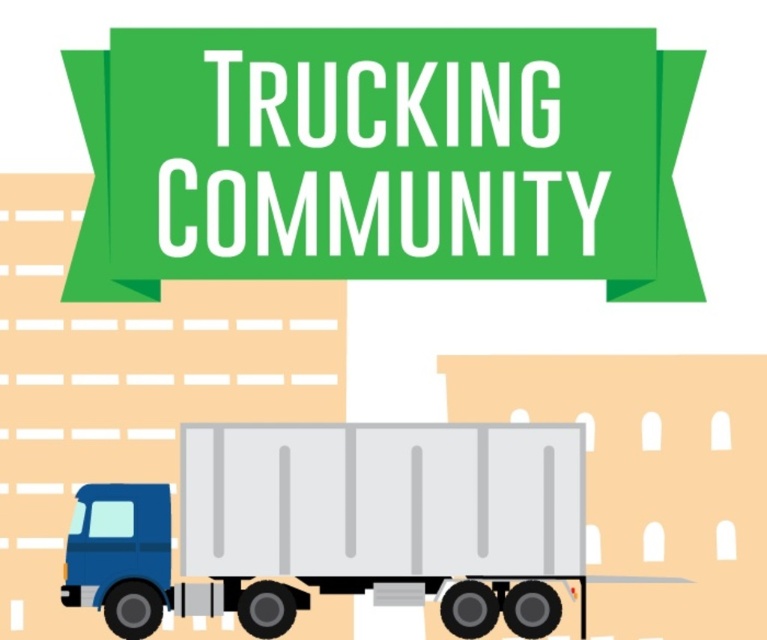
You are designing a poster and want to place a sticker on the green fabric banner at upper center. The sticker requires a space wider than the matte gray trailer truck at lower left. Will the banner provide enough space?

The green fabric banner at upper center has a width less than the matte gray trailer truck at lower left, so the sticker requiring space wider than the truck won

You are designing a poster for a trucking event and need to ensure the green fabric banner at upper center is visible from a distance. Considering its size relative to the matte gray trailer truck at lower left, will the banner be easy to see?

The green fabric banner at upper center is smaller than the matte gray trailer truck at lower left, so it may not be as visible from a distance unless additional emphasis is applied.

What are the coordinates of the green fabric banner at upper center in the image?

The green fabric banner at upper center is located at coordinates point (382,157).